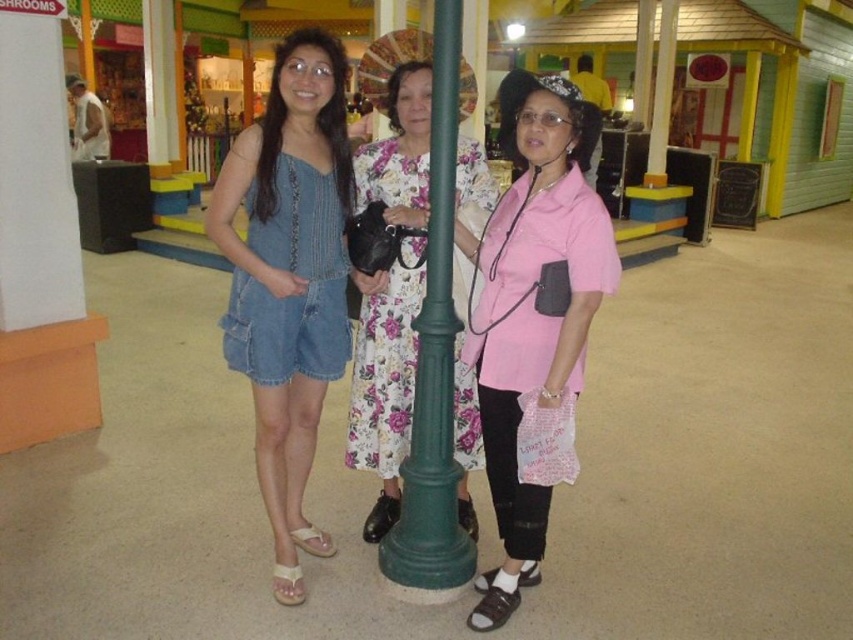
Question: Which object appears farthest from the camera in this image?

Choices:
 (A) pink matte shirt at center
 (B) denim romper at center

Answer: (B)

Question: Which point is closer to the camera taking this photo?

Choices:
 (A) 308,444
 (B) 482,612

Answer: (B)

Question: Observing the image, what is the correct spatial positioning of pink matte shirt at center in reference to denim romper at center?

Choices:
 (A) left
 (B) right

Answer: (B)

Question: Can you confirm if pink matte shirt at center is smaller than denim romper at center?

Choices:
 (A) yes
 (B) no

Answer: (B)

Question: Which of the following is the farthest from the observer?

Choices:
 (A) (393, 198)
 (B) (567, 86)

Answer: (A)

Question: Is pink matte shirt at center to the right of denim romper at center from the viewer's perspective?

Choices:
 (A) yes
 (B) no

Answer: (A)